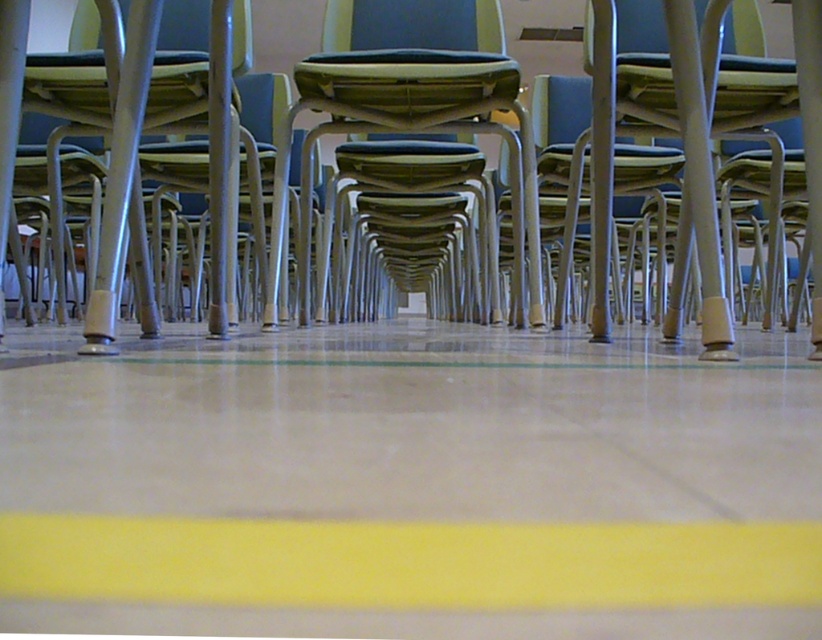
You are a janitor in a classroom and need to place a new chair exactly where the metallic gray chair at center is currently located. However, you must ensure that the chair does not cross the yellow matte line at lower center. Based on the current arrangement, will the chair fit without crossing the line?

The yellow matte line at lower center is positioned on the left side of the metallic gray chair at center, so placing the new chair in the same spot would mean its left side would align with the line. Since the line is on the left, the chair would not cross it as long as it is placed precisely there.